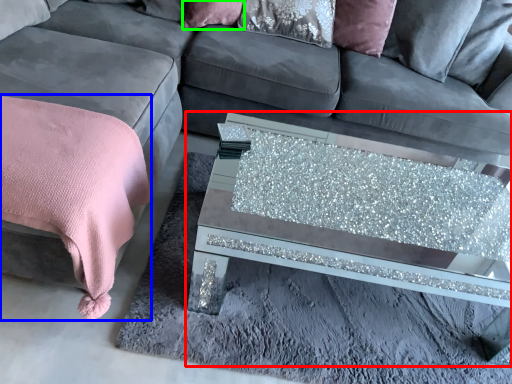
Question: Which object is the farthest from coffee table (highlighted by a red box)? Choose among these: blanket (highlighted by a blue box) or pillow (highlighted by a green box).

Choices:
 (A) blanket
 (B) pillow

Answer: (B)